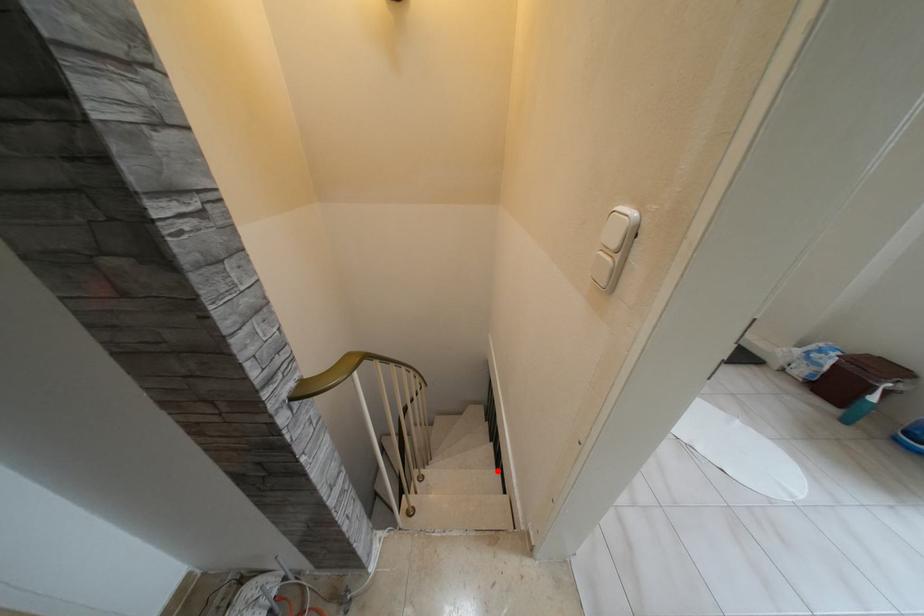
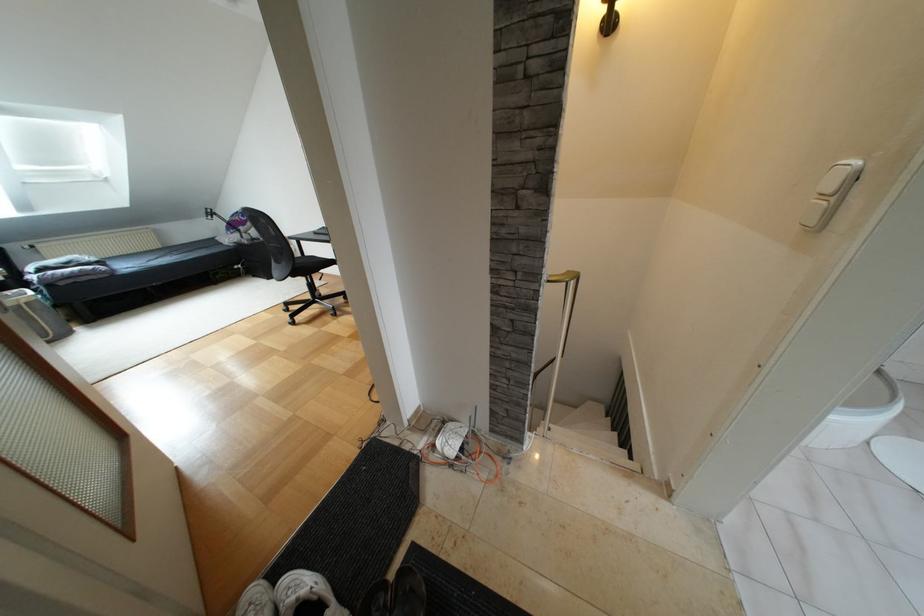
Locate, in the second image, the point that corresponds to the highlighted location in the first image.

(624, 451)